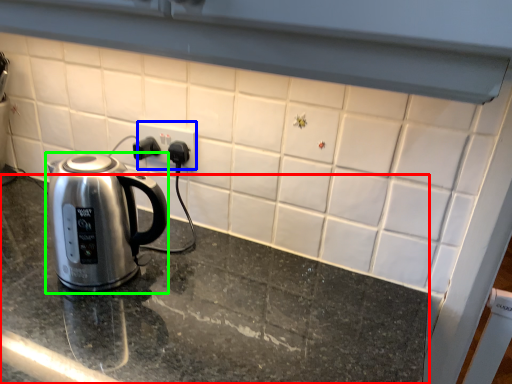
Question: Which object is the closest to the table top (highlighted by a red box)? Choose among these: electric outlet (highlighted by a blue box) or kettle (highlighted by a green box).

Choices:
 (A) electric outlet
 (B) kettle

Answer: (B)